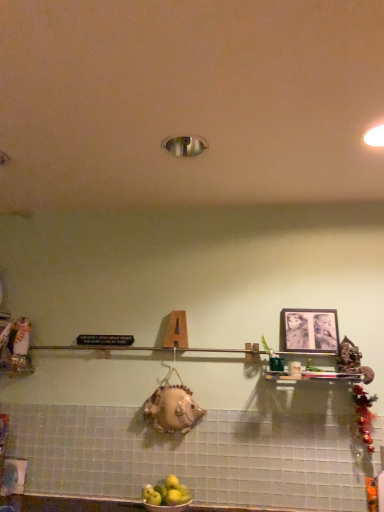
Locate an element on the screen. The height and width of the screenshot is (512, 384). yellow matte apples at lower center is located at coordinates (166, 493).

The width and height of the screenshot is (384, 512). What do you see at coordinates (166, 493) in the screenshot?
I see `yellow matte apples at lower center` at bounding box center [166, 493].

This screenshot has height=512, width=384. Describe the element at coordinates (309, 331) in the screenshot. I see `black matte picture frame at upper right` at that location.

This screenshot has width=384, height=512. In order to click on black matte picture frame at upper right in this screenshot , I will do `click(309, 331)`.

Find the location of a particular element. yellow matte apples at lower center is located at coordinates (166, 493).

Visually, is yellow matte apples at lower center positioned to the left or to the right of black matte picture frame at upper right?

Based on their positions, yellow matte apples at lower center is located to the left of black matte picture frame at upper right.

Which object is more forward, yellow matte apples at lower center or black matte picture frame at upper right?

Positioned in front is yellow matte apples at lower center.

Is point (173, 505) positioned before point (284, 328)?

Yes, it is in front of point (284, 328).

From the image's perspective, is yellow matte apples at lower center on black matte picture frame at upper right?

Actually, yellow matte apples at lower center appears below black matte picture frame at upper right in the image.

From a real-world perspective, who is located lower, yellow matte apples at lower center or black matte picture frame at upper right?

yellow matte apples at lower center.

Between yellow matte apples at lower center and black matte picture frame at upper right, which one has smaller width?

black matte picture frame at upper right.

Considering the sizes of yellow matte apples at lower center and black matte picture frame at upper right in the image, is yellow matte apples at lower center taller or shorter than black matte picture frame at upper right?

In the image, yellow matte apples at lower center appears to be shorter than black matte picture frame at upper right.

Can you confirm if yellow matte apples at lower center is smaller than black matte picture frame at upper right?

No.

Choose the correct answer: Is yellow matte apples at lower center inside black matte picture frame at upper right or outside it?

yellow matte apples at lower center is spatially situated outside black matte picture frame at upper right.

Are yellow matte apples at lower center and black matte picture frame at upper right far apart?

Actually, yellow matte apples at lower center and black matte picture frame at upper right are a little close together.

Does yellow matte apples at lower center turn towards black matte picture frame at upper right?

No, yellow matte apples at lower center is not turned towards black matte picture frame at upper right.

Can you tell me how much yellow matte apples at lower center and black matte picture frame at upper right differ in facing direction?

The facing directions of yellow matte apples at lower center and black matte picture frame at upper right are 1.13 degrees apart.

Measure the distance from yellow matte apples at lower center to black matte picture frame at upper right.

yellow matte apples at lower center is 36.96 inches from black matte picture frame at upper right.

In the image, there is a black matte picture frame at upper right. Where is `apple below it (from a real-world perspective)`? The width and height of the screenshot is (384, 512). apple below it (from a real-world perspective) is located at coordinates pyautogui.click(x=166, y=493).

Is black matte picture frame at upper right to the left or to the right of yellow matte apples at lower center in the image?

Based on their positions, black matte picture frame at upper right is located to the right of yellow matte apples at lower center.

Between black matte picture frame at upper right and yellow matte apples at lower center, which one is positioned behind?

black matte picture frame at upper right.

Which is in front, point (314, 318) or point (173, 487)?

The point (173, 487) is more forward.

From the image's perspective, is black matte picture frame at upper right under yellow matte apples at lower center?

No, from the image's perspective, black matte picture frame at upper right is not below yellow matte apples at lower center.

From a real-world perspective, who is located lower, black matte picture frame at upper right or yellow matte apples at lower center?

yellow matte apples at lower center, from a real-world perspective.

Considering the sizes of objects black matte picture frame at upper right and yellow matte apples at lower center in the image provided, who is thinner, black matte picture frame at upper right or yellow matte apples at lower center?

black matte picture frame at upper right is thinner.

Can you confirm if black matte picture frame at upper right is taller than yellow matte apples at lower center?

Yes.

Can you confirm if black matte picture frame at upper right is bigger than yellow matte apples at lower center?

No.

Would you say black matte picture frame at upper right contains yellow matte apples at lower center?

No, yellow matte apples at lower center is not inside black matte picture frame at upper right.

From the picture: Can you see black matte picture frame at upper right touching yellow matte apples at lower center?

black matte picture frame at upper right and yellow matte apples at lower center are not in contact.

Could you tell me if black matte picture frame at upper right is facing yellow matte apples at lower center?

No, black matte picture frame at upper right is not oriented towards yellow matte apples at lower center.

Measure the distance from black matte picture frame at upper right to yellow matte apples at lower center.

black matte picture frame at upper right is 36.96 inches away from yellow matte apples at lower center.

Image resolution: width=384 pixels, height=512 pixels. Identify the location of apple below the black matte picture frame at upper right (from the image's perspective). (166, 493).

Image resolution: width=384 pixels, height=512 pixels. In order to click on apple that appears in front of the black matte picture frame at upper right in this screenshot , I will do `click(166, 493)`.

Find the location of a particular element. This screenshot has height=512, width=384. picture frame above the yellow matte apples at lower center (from a real-world perspective) is located at coordinates (309, 331).